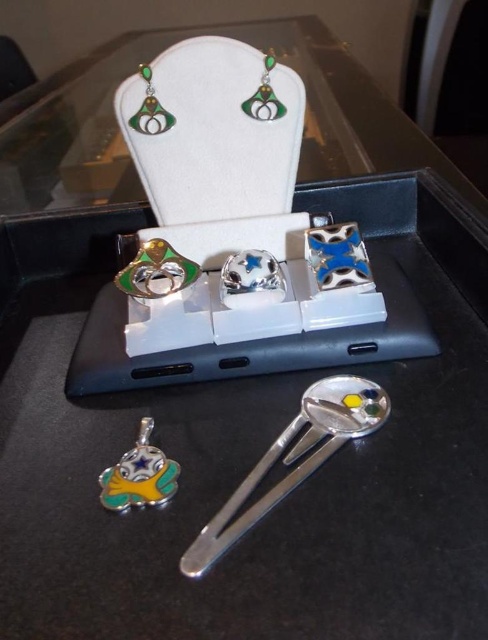
Which is below, shiny silver spoon at lower center or green enamel earring at upper center?

shiny silver spoon at lower center

Who is shorter, shiny silver spoon at lower center or green enamel earring at upper center?

green enamel earring at upper center

What do you see at coordinates (292, 458) in the screenshot? I see `shiny silver spoon at lower center` at bounding box center [292, 458].

This screenshot has height=640, width=488. Identify the location of shiny silver spoon at lower center. (x=292, y=458).

From the picture: Is metallic pendant at center shorter than green enamel earring at upper center?

Correct, metallic pendant at center is not as tall as green enamel earring at upper center.

Between metallic pendant at center and green enamel earring at upper center, which one appears on the left side from the viewer's perspective?

Positioned to the left is metallic pendant at center.

In order to click on metallic pendant at center in this screenshot , I will do `click(139, 476)`.

Between shiny silver spoon at lower center and metallic pendant at center, which one is positioned higher?

metallic pendant at center

Does shiny silver spoon at lower center have a lesser width compared to metallic pendant at center?

In fact, shiny silver spoon at lower center might be wider than metallic pendant at center.

Is point (350, 397) positioned after point (133, 480)?

That is True.

Where is `shiny silver spoon at lower center`? The image size is (488, 640). shiny silver spoon at lower center is located at coordinates (292, 458).